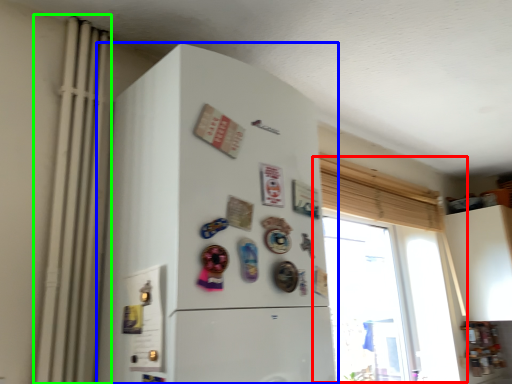
Question: Which object is the farthest from window (highlighted by a red box)? Choose among these: refrigerator (highlighted by a blue box) or radiator (highlighted by a green box).

Choices:
 (A) refrigerator
 (B) radiator

Answer: (B)